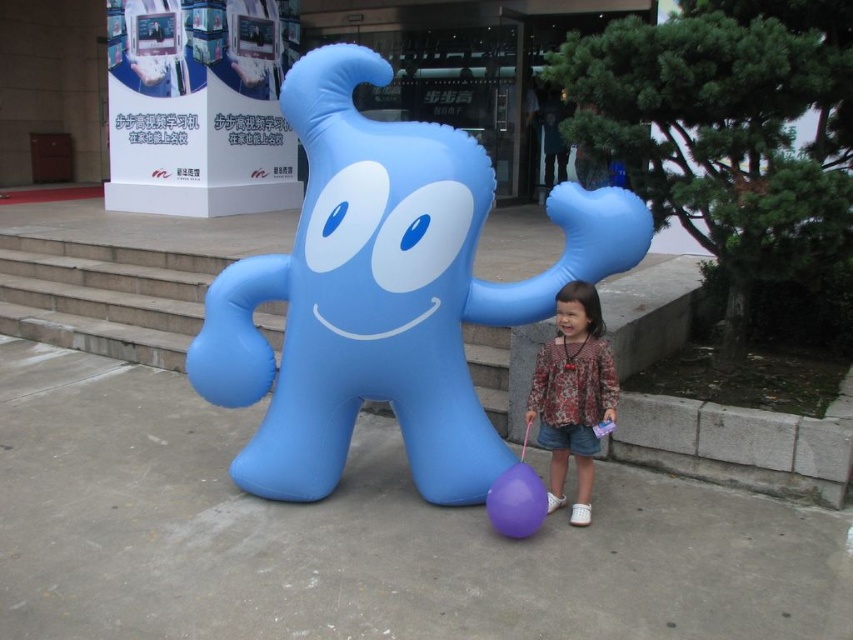
You are standing in the outdoor scene with the inflatable blue character. Where is the floral fabric dress at lower right located?

The floral fabric dress at lower right is located at point (x=573, y=394).

You are trying to decide whether to place a new small plant pot between the matte blue inflatable at center and the floral fabric dress at lower right. Based on their sizes, will there be enough space for the pot?

The matte blue inflatable at center might be wider than floral fabric dress at lower right, so there may not be enough space for the plant pot between them. Check the actual width before placing it.